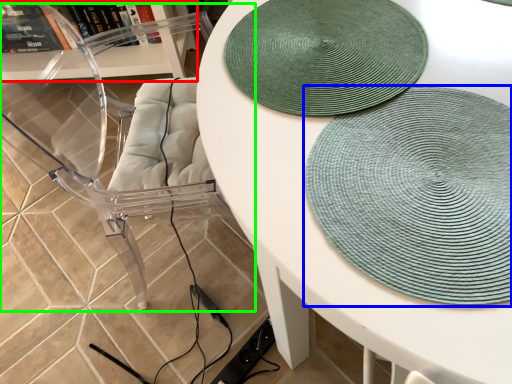
Question: Which object is positioned closest to shelf (highlighted by a red box)? Select from mat (highlighted by a blue box) and swivel chair (highlighted by a green box).

Choices:
 (A) mat
 (B) swivel chair

Answer: (B)